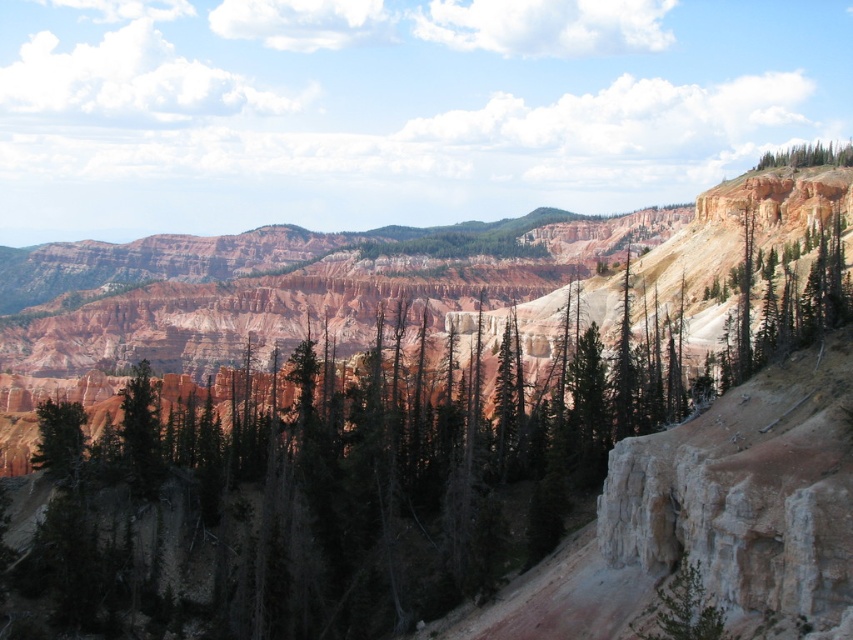
Question: Which point is farther from the camera taking this photo?

Choices:
 (A) (310, 458)
 (B) (762, 164)

Answer: (B)

Question: Considering the relative positions of green matte tree at center and green textured tree at upper right in the image provided, where is green matte tree at center located with respect to green textured tree at upper right?

Choices:
 (A) below
 (B) above

Answer: (A)

Question: Is green matte tree at center positioned behind green textured tree at upper right?

Choices:
 (A) no
 (B) yes

Answer: (A)

Question: Which object is closer to the camera taking this photo?

Choices:
 (A) green textured tree at upper right
 (B) green matte tree at center

Answer: (B)

Question: Where is green matte tree at center located in relation to green textured tree at upper right in the image?

Choices:
 (A) right
 (B) left

Answer: (B)